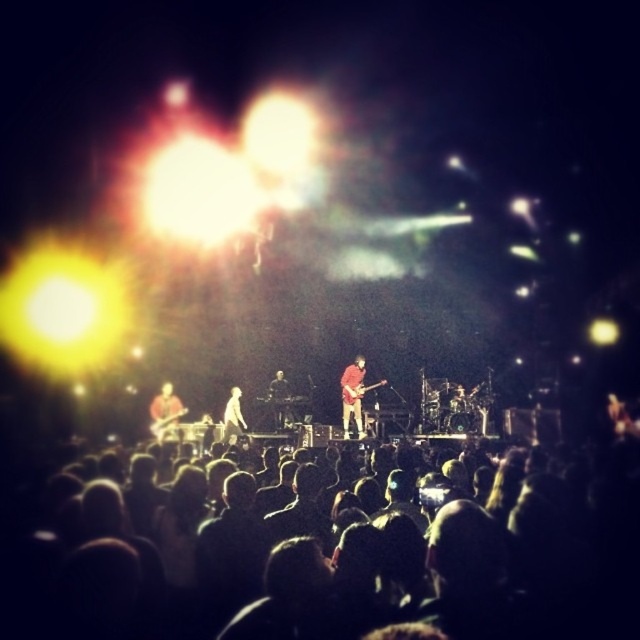
You are a stagehand who needs to place a protective cover over both the red fabric guitar at center and the matte black guitar at center. Which guitar requires a taller cover?

The red fabric guitar at center requires a taller cover because it is taller than the matte black guitar at center.

You are a photographer at the concert. You want to capture a photo where the dark matte crowd at lower center is visible above the white fabric at center. Is this possible?

The dark matte crowd at lower center is shorter than the white fabric at center, so they cannot be seen above it.